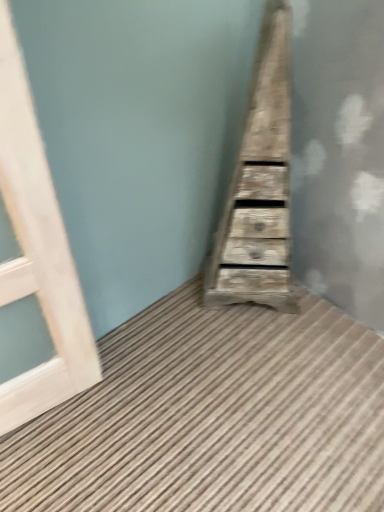
Describe the element at coordinates (259, 188) in the screenshot. I see `distressed wood dresser at center` at that location.

Image resolution: width=384 pixels, height=512 pixels. Find the location of `distressed wood dresser at center`. distressed wood dresser at center is located at coordinates (259, 188).

At what (x,y) coordinates should I click in order to perform the action: click on distressed wood dresser at center. Please return your answer as a coordinate pair (x, y). This screenshot has width=384, height=512. Looking at the image, I should click on (259, 188).